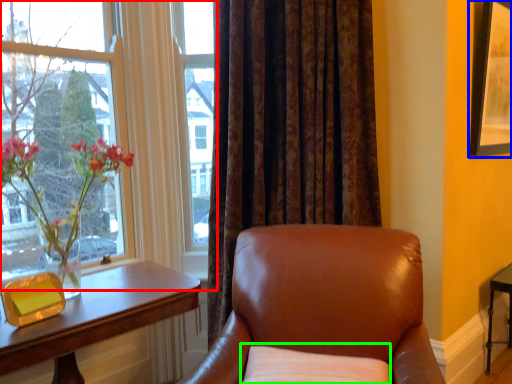
Question: Based on their relative distances, which object is farther from window (highlighted by a red box)? Choose from picture frame (highlighted by a blue box) and pillow (highlighted by a green box).

Choices:
 (A) picture frame
 (B) pillow

Answer: (A)